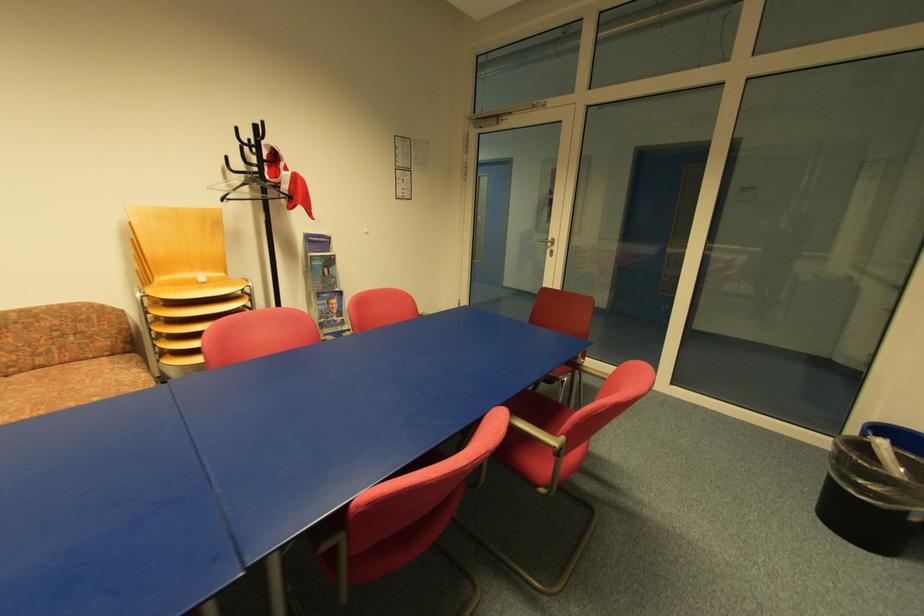
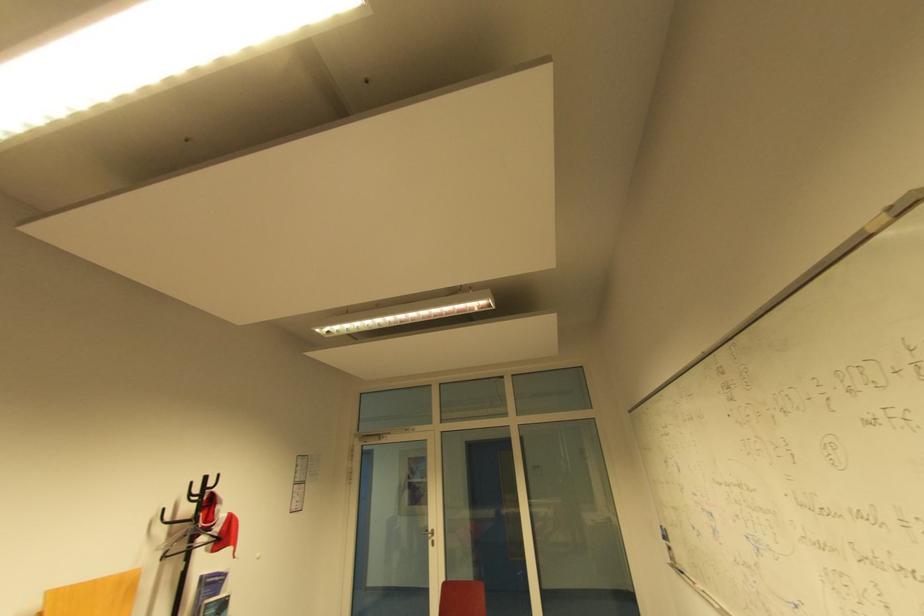
Find the pixel in the second image that matches point 299,180 in the first image.

(235, 521)